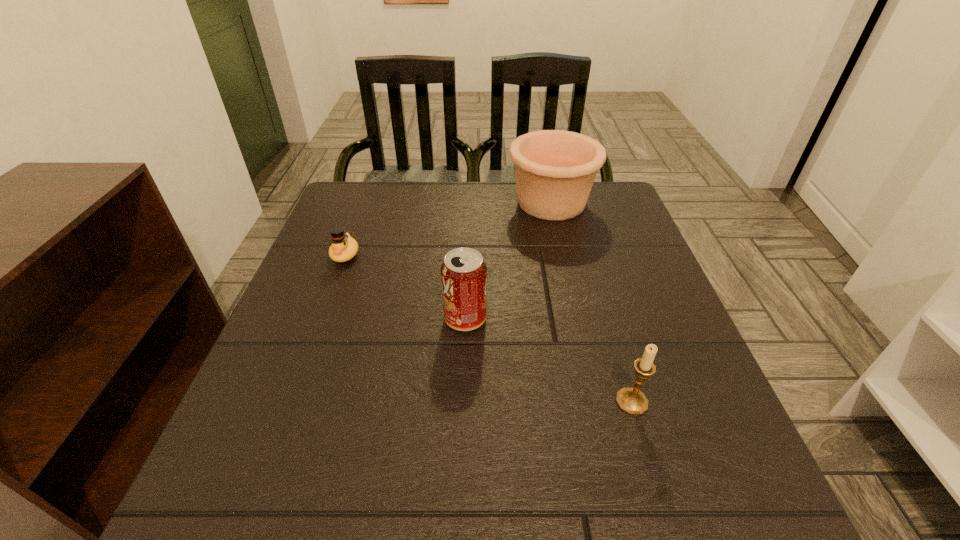
At what (x,y) coordinates should I click in order to perform the action: click on vacant point located between the nearest object and the pottery. Please return your answer as a coordinate pair (x, y). The image size is (960, 540). Looking at the image, I should click on (591, 302).

This screenshot has height=540, width=960. Find the location of `free space between the nearest object and the duck`. free space between the nearest object and the duck is located at coordinates (489, 328).

You are a GUI agent. You are given a task and a screenshot of the screen. Output one action in this format:
    pyautogui.click(x=<x>, y=<y>)
    Task: Click on the vacant region between the nearest object and the farthest object
    
    Given the screenshot: What is the action you would take?
    pyautogui.click(x=591, y=302)

The height and width of the screenshot is (540, 960). I want to click on the third closest object to the pottery, so click(x=631, y=400).

In order to click on the second closest object to the farthest object in this screenshot , I will do `click(343, 247)`.

What are the coordinates of `free space that satisfies the following two spatial constraints: 1. on the back side of the pottery; 2. on the left side of the second object from left to right` in the screenshot? It's located at (469, 202).

Where is `free space that satisfies the following two spatial constraints: 1. on the front-facing side of the leftmost object; 2. on the right side of the second object from left to right`? The image size is (960, 540). free space that satisfies the following two spatial constraints: 1. on the front-facing side of the leftmost object; 2. on the right side of the second object from left to right is located at coordinates (322, 319).

Image resolution: width=960 pixels, height=540 pixels. Find the location of `free space that satisfies the following two spatial constraints: 1. on the front side of the pottery; 2. on the right side of the nearest object`. free space that satisfies the following two spatial constraints: 1. on the front side of the pottery; 2. on the right side of the nearest object is located at coordinates (597, 401).

You are a GUI agent. You are given a task and a screenshot of the screen. Output one action in this format:
    pyautogui.click(x=<x>, y=<y>)
    Task: Click on the free location that satisfies the following two spatial constraints: 1. on the front-facing side of the third farthest object; 2. on the left side of the leftmost object
    The width and height of the screenshot is (960, 540).
    Given the screenshot: What is the action you would take?
    pyautogui.click(x=322, y=319)